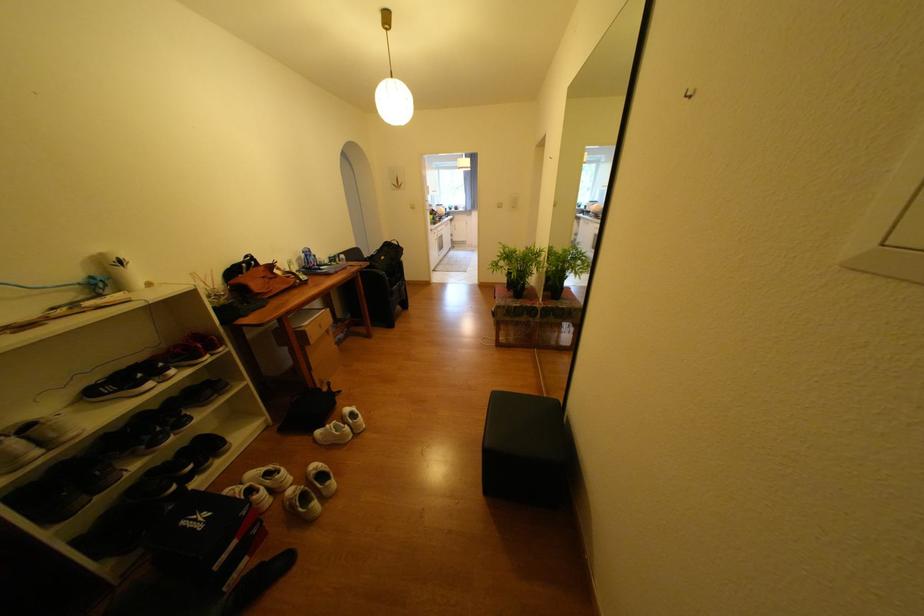
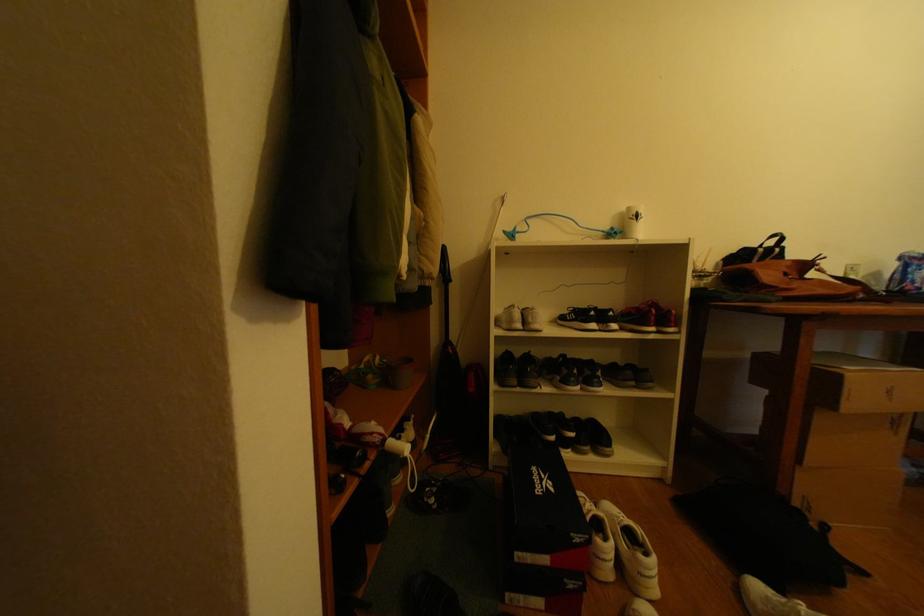
Question: The images are taken continuously from a first-person perspective. In which direction is your viewpoint rotating?

Choices:
 (A) Left
 (B) Right
 (C) Up
 (D) Down

Answer: (A)